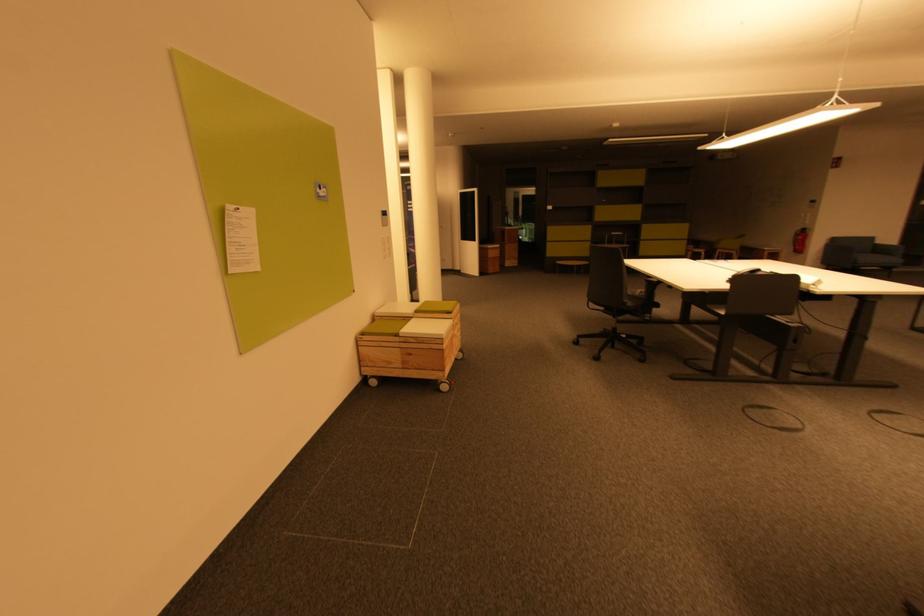
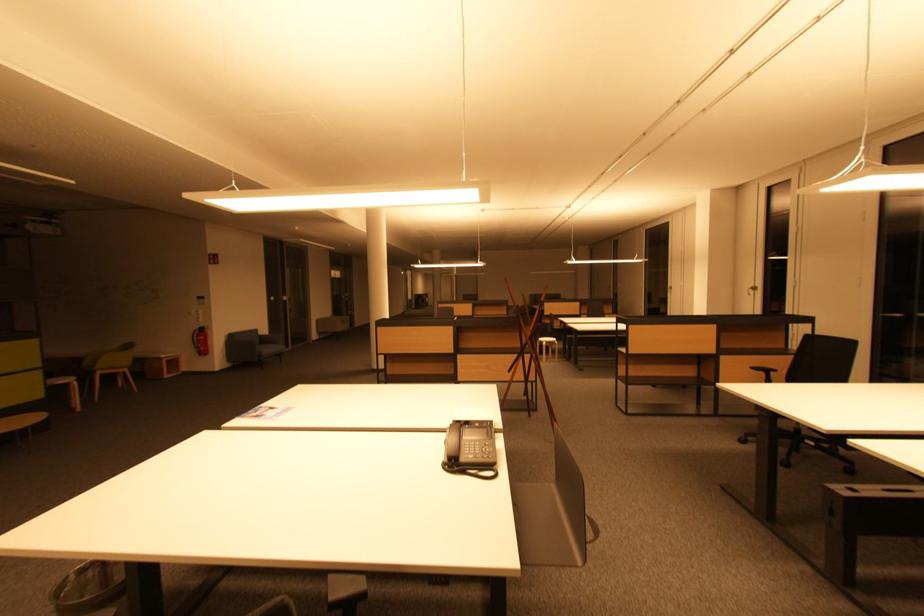
Locate, in the second image, the point that corresponds to point (839, 243) in the first image.

(236, 339)